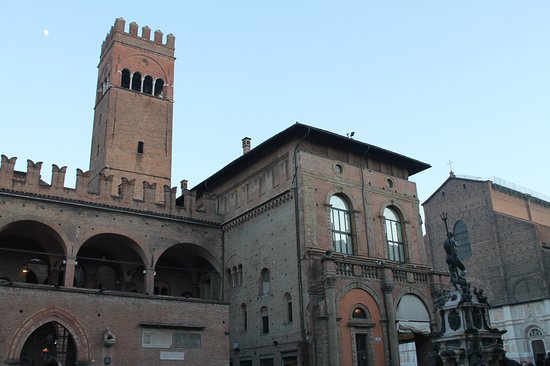
You are a GUI agent. You are given a task and a screenshot of the screen. Output one action in this format:
    pyautogui.click(x=<x>, y=<y>)
    Task: Click on the door
    The width and height of the screenshot is (550, 366).
    Given the screenshot: What is the action you would take?
    pyautogui.click(x=358, y=348), pyautogui.click(x=537, y=348)